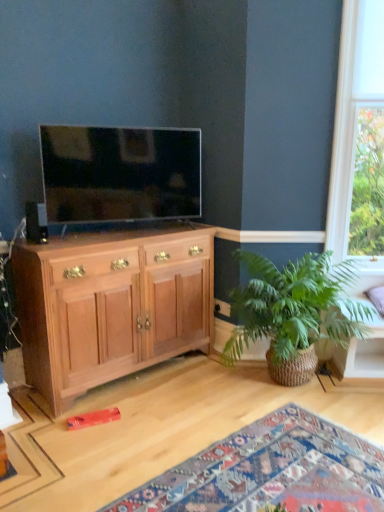
The width and height of the screenshot is (384, 512). Find the location of `vacant region in front of wooden cabinet at left`. vacant region in front of wooden cabinet at left is located at coordinates (117, 430).